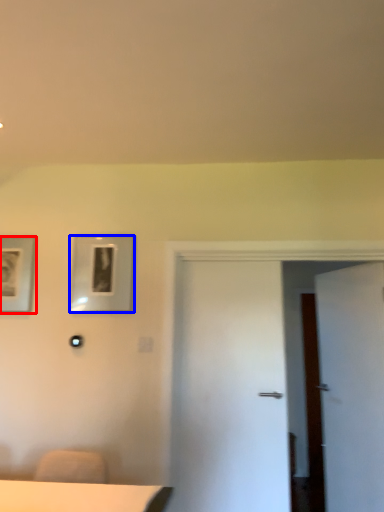
Question: Which point is closer to the camera, picture frame (highlighted by a red box) or picture frame (highlighted by a blue box)?

Choices:
 (A) picture frame
 (B) picture frame

Answer: (B)